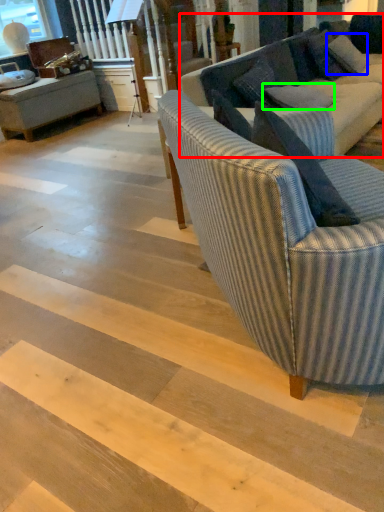
Question: Based on their relative distances, which object is farther from studio couch (highlighted by a red box)? Choose from pillow (highlighted by a blue box) and pillow (highlighted by a green box).

Choices:
 (A) pillow
 (B) pillow

Answer: (A)